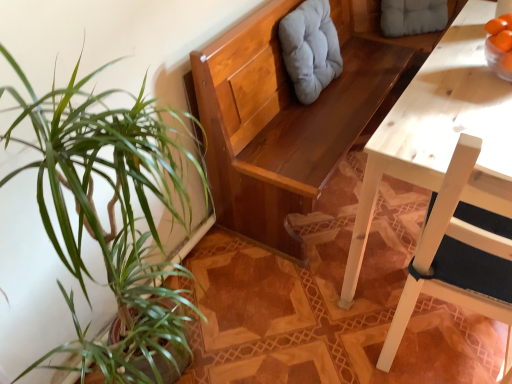
Question: Considering the positions of white wood chair at right and light gray fabric cushion at upper center, the second swivel chair from the back, in the image, is white wood chair at right taller or shorter than light gray fabric cushion at upper center, the second swivel chair from the back,?

Choices:
 (A) short
 (B) tall

Answer: (B)

Question: Is white wood chair at right in front of or behind light gray fabric cushion at upper center, the 1th swivel chair in the left-to-right sequence, in the image?

Choices:
 (A) behind
 (B) front

Answer: (B)

Question: Which is farther from the white wood chair at right?

Choices:
 (A) gray fabric cushion at upper center, which ranks as the second swivel chair in front-to-back order
 (B) light gray fabric cushion at upper center, marked as the 2th swivel chair in a right-to-left arrangement

Answer: (A)

Question: Estimate the real-world distances between objects in this image. Which object is farther from the white wood chair at right?

Choices:
 (A) light gray fabric cushion at upper center, the second swivel chair from the back
 (B) gray fabric cushion at upper center, which ranks as the second swivel chair in front-to-back order

Answer: (B)